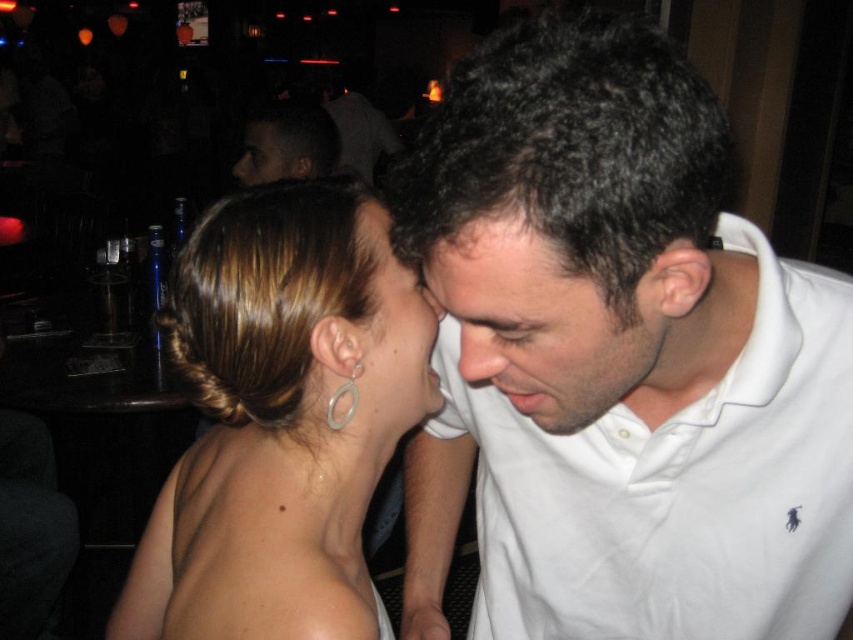
Does white smooth shirt at center appear on the left side of matte black face at upper center?

No, white smooth shirt at center is not to the left of matte black face at upper center.

Find the location of a particular element. white smooth shirt at center is located at coordinates (549, 324).

In order to click on white smooth shirt at center in this screenshot , I will do `click(549, 324)`.

Is matte black face at upper center taller than silver metallic hoop at ear?

Correct, matte black face at upper center is much taller as silver metallic hoop at ear.

Which is below, matte black face at upper center or silver metallic hoop at ear?

silver metallic hoop at ear is below.

Locate an element on the screen. This screenshot has height=640, width=853. matte black face at upper center is located at coordinates (265, 154).

At what (x,y) coordinates should I click in order to perform the action: click on matte black face at upper center. Please return your answer as a coordinate pair (x, y). The image size is (853, 640). Looking at the image, I should click on (265, 154).

Between point (654, 301) and point (354, 387), which one is positioned in front?

Point (654, 301)

Can you confirm if white smooth shirt at center is positioned below silver metallic hoop at ear?

No, white smooth shirt at center is not below silver metallic hoop at ear.

Is point (578, 380) less distant than point (335, 429)?

Yes, it is in front of point (335, 429).

At what (x,y) coordinates should I click in order to perform the action: click on white smooth shirt at center. Please return your answer as a coordinate pair (x, y). Image resolution: width=853 pixels, height=640 pixels. Looking at the image, I should click on (549, 324).